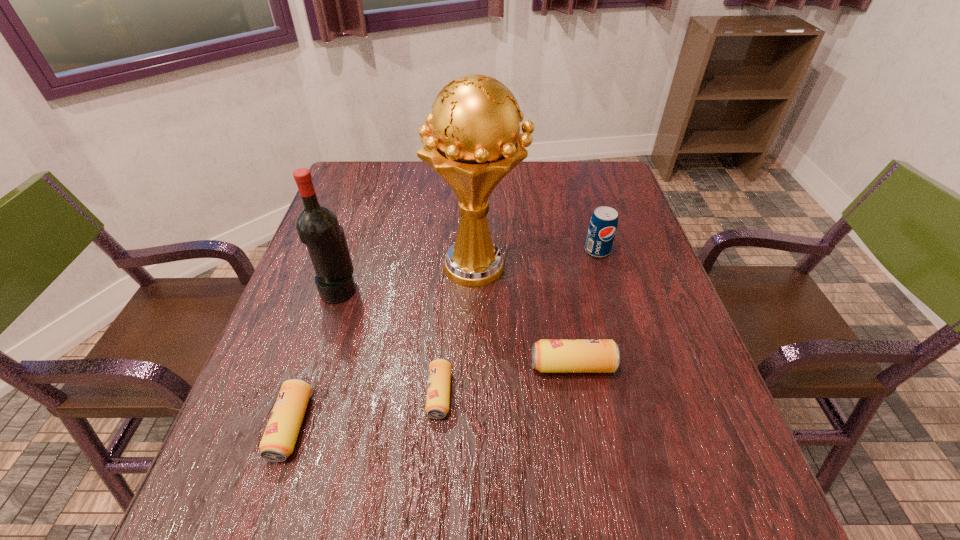
Please point a vacant point for placing a beer can on the right. Please provide its 2D coordinates. Your answer should be formatted as a tuple, i.e. [(x, y)], where the tuple contains the x and y coordinates of a point satisfying the conditions above.

[(692, 340)]